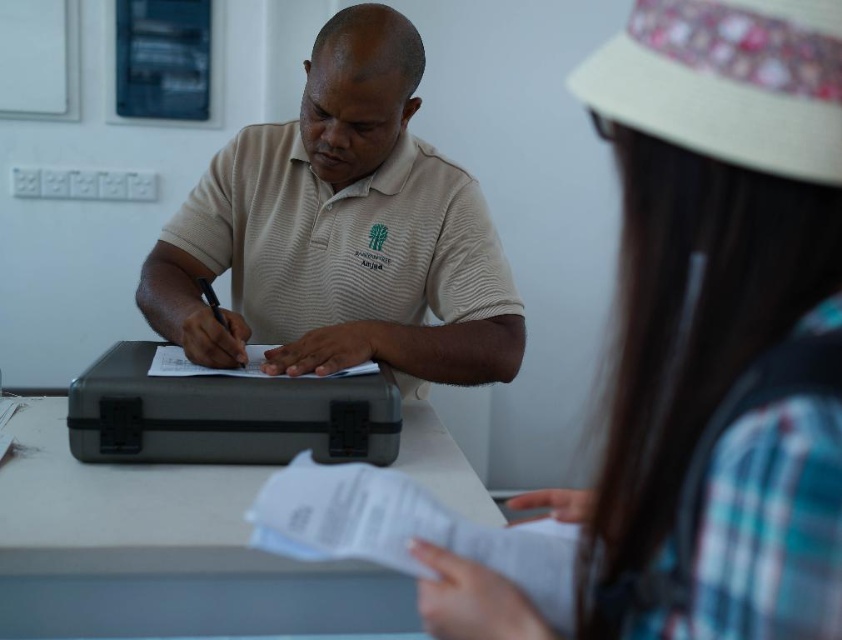
Question: Does matte gray briefcase at center lie behind white paper at lower center?

Choices:
 (A) no
 (B) yes

Answer: (B)

Question: Which object is closer to the camera taking this photo?

Choices:
 (A) white paper at lower center
 (B) plaid fabric shirt at upper right

Answer: (B)

Question: Which point is closer to the camera?

Choices:
 (A) white paper at lower center
 (B) plaid fabric shirt at upper right
 (C) beige striped polo shirt at center
 (D) matte gray briefcase at center

Answer: (B)

Question: Which point is farther to the camera?

Choices:
 (A) beige striped polo shirt at center
 (B) matte gray briefcase at center
 (C) white paper at lower center

Answer: (A)

Question: Does matte gray briefcase at center have a greater width compared to white paper at lower center?

Choices:
 (A) no
 (B) yes

Answer: (B)

Question: Can you confirm if plaid fabric shirt at upper right is wider than white paper at lower center?

Choices:
 (A) no
 (B) yes

Answer: (A)